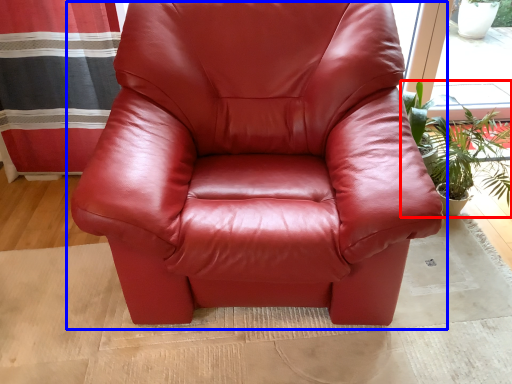
Question: Among these objects, which one is farthest to the camera, houseplant (highlighted by a red box) or chair (highlighted by a blue box)?

Choices:
 (A) houseplant
 (B) chair

Answer: (A)